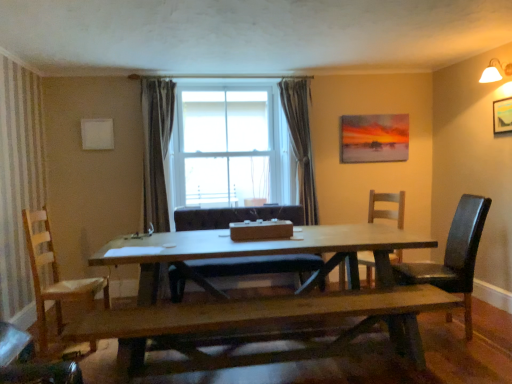
Question: Considering their positions, is light brown wooden chair at left, the 1th chair viewed from the left, located in front of or behind wooden chair at right, the 3th chair when ordered from left to right?

Choices:
 (A) behind
 (B) front

Answer: (B)

Question: From the image's perspective, is light brown wooden chair at left, the 1th chair viewed from the left, located above or below wooden chair at right, which is the second chair in right-to-left order?

Choices:
 (A) below
 (B) above

Answer: (A)

Question: Which object is positioned farthest from the light brown wooden chair at left, the 1th chair viewed from the left?

Choices:
 (A) black leather chair at right, which is the 1th chair from right to left
 (B) dark gray textured curtain at center
 (C) wooden picture frame at upper right, acting as the first picture frame starting from the right
 (D) white fabric lampshade at upper right
 (E) matte acrylic painting at upper right, acting as the second picture frame starting from the front

Answer: (D)

Question: Which is nearer to the smooth brown leather chair at center, which appears as the third chair when viewed from the right?

Choices:
 (A) matte acrylic painting at upper right, which appears as the 2th picture frame when viewed from the right
 (B) dark gray textured curtain at center
 (C) wooden picture frame at upper right, which is counted as the second picture frame, starting from the back
 (D) wooden bench at center
 (E) black leather chair at right, which is the 1th chair from right to left

Answer: (B)